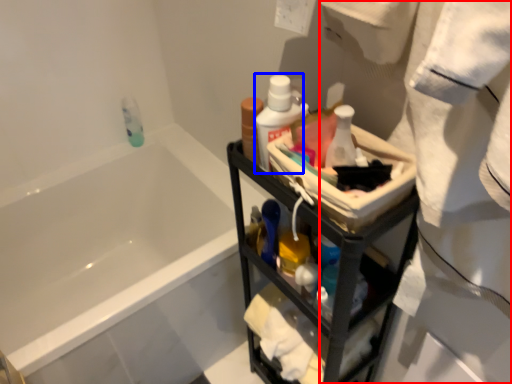
Question: Which object appears closest to the camera in this image, bath towel (highlighted by a red box) or mouthwash (highlighted by a blue box)?

Choices:
 (A) bath towel
 (B) mouthwash

Answer: (A)